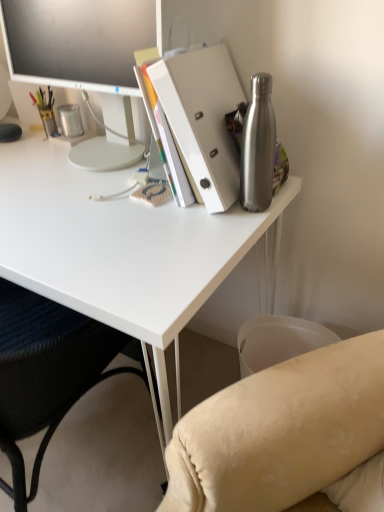
Question: Is metallic silver pen holder at left facing towards white matte folder at upper right?

Choices:
 (A) yes
 (B) no

Answer: (B)

Question: Considering the relative sizes of metallic silver pen holder at left and white matte folder at upper right in the image provided, is metallic silver pen holder at left bigger than white matte folder at upper right?

Choices:
 (A) yes
 (B) no

Answer: (B)

Question: Can you confirm if metallic silver pen holder at left is wider than white matte folder at upper right?

Choices:
 (A) yes
 (B) no

Answer: (B)

Question: Is metallic silver pen holder at left shorter than white matte folder at upper right?

Choices:
 (A) yes
 (B) no

Answer: (A)

Question: Considering the relative positions of metallic silver pen holder at left and white matte folder at upper right in the image provided, is metallic silver pen holder at left behind white matte folder at upper right?

Choices:
 (A) yes
 (B) no

Answer: (A)

Question: Based on their sizes in the image, would you say white matte desk at upper center is bigger or smaller than white glossy monitor at upper left?

Choices:
 (A) big
 (B) small

Answer: (A)

Question: Is white matte desk at upper center taller or shorter than white glossy monitor at upper left?

Choices:
 (A) short
 (B) tall

Answer: (B)

Question: Relative to white glossy monitor at upper left, is white matte desk at upper center in front or behind?

Choices:
 (A) front
 (B) behind

Answer: (A)

Question: From a real-world perspective, is white matte desk at upper center physically located above or below white glossy monitor at upper left?

Choices:
 (A) above
 (B) below

Answer: (B)

Question: Looking at the image, does brushed metal water bottle at right seem bigger or smaller compared to white matte desk at upper center?

Choices:
 (A) big
 (B) small

Answer: (B)

Question: From the image's perspective, is brushed metal water bottle at right positioned above or below white matte desk at upper center?

Choices:
 (A) above
 (B) below

Answer: (A)

Question: In terms of height, does brushed metal water bottle at right look taller or shorter compared to white matte desk at upper center?

Choices:
 (A) short
 (B) tall

Answer: (A)

Question: Visually, is brushed metal water bottle at right positioned to the left or to the right of white matte desk at upper center?

Choices:
 (A) left
 (B) right

Answer: (B)

Question: From a real-world perspective, relative to metallic silver pen holder at left, is white matte desk at upper center vertically above or below?

Choices:
 (A) above
 (B) below

Answer: (B)

Question: Is white matte desk at upper center bigger or smaller than metallic silver pen holder at left?

Choices:
 (A) small
 (B) big

Answer: (B)